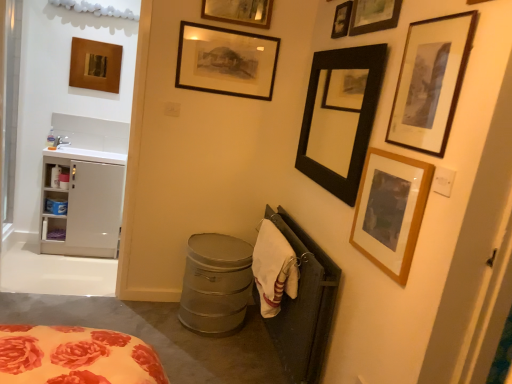
Question: Does wooden picture frame at upper left, arranged as the 8th picture frame when viewed from the right, have a larger size compared to white plastic cabinet at left?

Choices:
 (A) no
 (B) yes

Answer: (B)

Question: Does wooden picture frame at upper left, the 1th picture frame from the left, have a smaller size compared to white plastic cabinet at left?

Choices:
 (A) no
 (B) yes

Answer: (A)

Question: Is the position of wooden picture frame at upper left, arranged as the 8th picture frame when viewed from the right, less distant than that of white plastic cabinet at left?

Choices:
 (A) no
 (B) yes

Answer: (B)

Question: Is wooden picture frame at upper left, arranged as the 8th picture frame when viewed from the right, shorter than white plastic cabinet at left?

Choices:
 (A) no
 (B) yes

Answer: (A)

Question: Does wooden picture frame at upper left, the 1th picture frame from the left, lie behind white plastic cabinet at left?

Choices:
 (A) yes
 (B) no

Answer: (B)

Question: Based on their positions, is white cotton towel at lower right located to the left or right of white matte cabinet at left?

Choices:
 (A) left
 (B) right

Answer: (B)

Question: From a real-world perspective, is white cotton towel at lower right physically located above or below white matte cabinet at left?

Choices:
 (A) above
 (B) below

Answer: (A)

Question: Is white cotton towel at lower right taller or shorter than white matte cabinet at left?

Choices:
 (A) short
 (B) tall

Answer: (A)

Question: In the image, is white cotton towel at lower right positioned in front of or behind white matte cabinet at left?

Choices:
 (A) front
 (B) behind

Answer: (A)

Question: Based on their sizes in the image, would you say wooden picture frame at upper right, arranged as the second picture frame when viewed from the right, is bigger or smaller than black matte picture frame at upper right, which is the 5th picture frame from right to left?

Choices:
 (A) small
 (B) big

Answer: (A)

Question: Would you say wooden picture frame at upper right, arranged as the second picture frame when viewed from the right, is inside or outside black matte picture frame at upper right, the fourth picture frame positioned from the left?

Choices:
 (A) inside
 (B) outside

Answer: (B)

Question: Is wooden picture frame at upper right, acting as the 7th picture frame starting from the left, wider or thinner than black matte picture frame at upper right, which is the 5th picture frame from right to left?

Choices:
 (A) thin
 (B) wide

Answer: (A)

Question: Is point (382, 19) positioned closer to the camera than point (318, 145)?

Choices:
 (A) closer
 (B) farther

Answer: (A)

Question: From the image's perspective, relative to wooden framed print at upper right, the 1th picture frame when ordered from right to left, is white cotton towel at lower right above or below?

Choices:
 (A) above
 (B) below

Answer: (B)

Question: Is white cotton towel at lower right in front of or behind wooden framed print at upper right, the 1th picture frame when ordered from right to left, in the image?

Choices:
 (A) front
 (B) behind

Answer: (B)